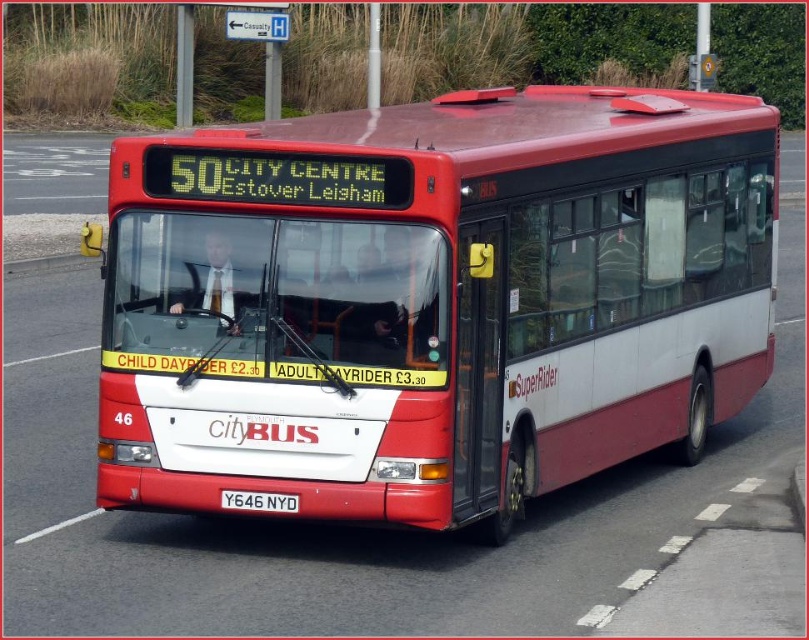
Does metal signpost at upper center have a lesser width compared to white metallic license plate at center?

Correct, metal signpost at upper center's width is less than white metallic license plate at center's.

Which is behind, point (185, 16) or point (223, 506)?

The point (185, 16) is behind.

Locate an element on the screen. This screenshot has width=809, height=640. metal signpost at upper center is located at coordinates (236, 38).

Can you confirm if matte red bus at center is positioned to the right of white metallic license plate at center?

No, matte red bus at center is not to the right of white metallic license plate at center.

Is matte red bus at center above white metallic license plate at center?

Yes, matte red bus at center is above white metallic license plate at center.

Between point (367, 150) and point (291, 513), which one is positioned in front?

Positioned in front is point (367, 150).

At what (x,y) coordinates should I click in order to perform the action: click on matte red bus at center. Please return your answer as a coordinate pair (x, y). Looking at the image, I should click on (433, 300).

Can you confirm if matte red bus at center is positioned to the left of metal signpost at upper center?

In fact, matte red bus at center is to the right of metal signpost at upper center.

Does matte red bus at center appear over metal signpost at upper center?

Actually, matte red bus at center is below metal signpost at upper center.

The image size is (809, 640). Identify the location of matte red bus at center. (433, 300).